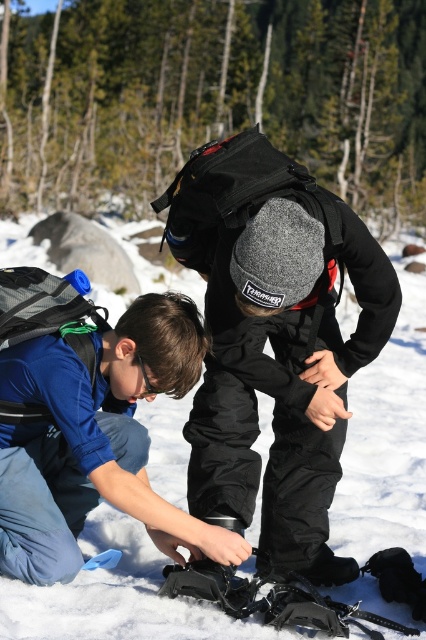
Question: Among these objects, which one is nearest to the camera?

Choices:
 (A) black plastic snowshoe at lower center
 (B) white fluffy snow at center

Answer: (B)

Question: Does white fluffy snow at center have a lesser width compared to black plastic snowshoe at lower center?

Choices:
 (A) no
 (B) yes

Answer: (A)

Question: In this image, where is white fluffy snow at center located relative to black plastic snowshoe at lower center?

Choices:
 (A) left
 (B) right

Answer: (A)

Question: Is white fluffy snow at center smaller than black plastic snowshoe at lower center?

Choices:
 (A) yes
 (B) no

Answer: (B)

Question: Which point is closer to the camera?

Choices:
 (A) white fluffy snow at center
 (B) black plastic snowshoe at lower center

Answer: (A)